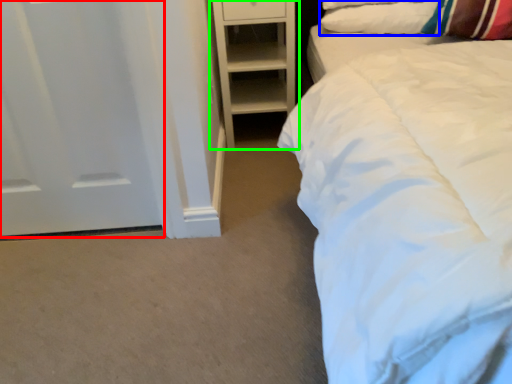
Question: Which object is the farthest from door (highlighted by a red box)? Choose among these: pillow (highlighted by a blue box) or shelf (highlighted by a green box).

Choices:
 (A) pillow
 (B) shelf

Answer: (A)